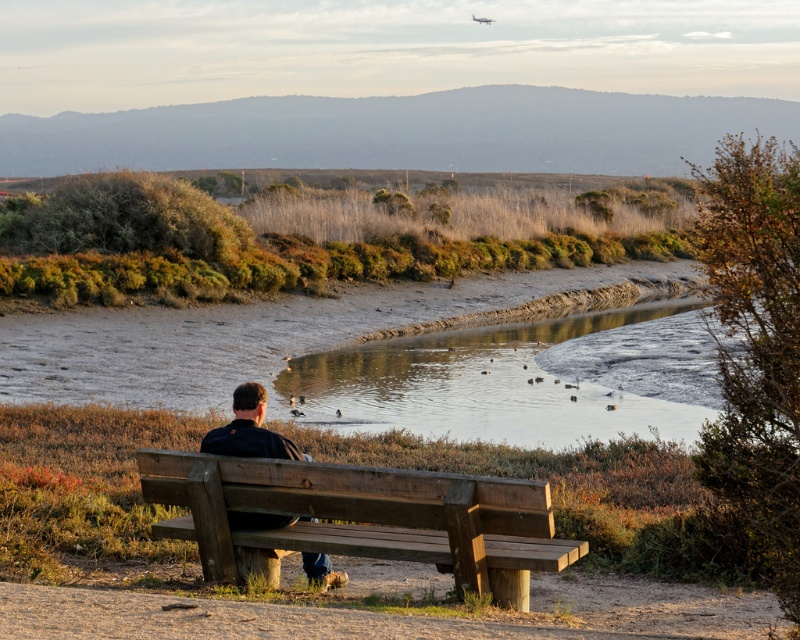
Find the location of a particular element. muddy water at center is located at coordinates (380, 356).

Is point (96, 332) positioned before point (262, 524)?

That is False.

Does point (649, 376) come behind point (345, 580)?

Yes, it is behind point (345, 580).

The height and width of the screenshot is (640, 800). In order to click on muddy water at center in this screenshot , I will do `click(380, 356)`.

Between point (193, 461) and point (250, 400), which one is positioned behind?

Point (250, 400)

Between wooden bench at center and dark brown leather jacket at center, which one appears on the left side from the viewer's perspective?

dark brown leather jacket at center is more to the left.

Is point (476, 531) in front of point (237, 440)?

Yes.

Where is `wooden bench at center`? wooden bench at center is located at coordinates (362, 516).

Is muddy water at center to the left of wooden bench at center from the viewer's perspective?

In fact, muddy water at center is to the right of wooden bench at center.

Is muddy water at center to the right of wooden bench at center from the viewer's perspective?

Indeed, muddy water at center is positioned on the right side of wooden bench at center.

Which is in front, point (436, 337) or point (268, 508)?

Point (268, 508)

Where is `muddy water at center`? This screenshot has height=640, width=800. muddy water at center is located at coordinates (380, 356).